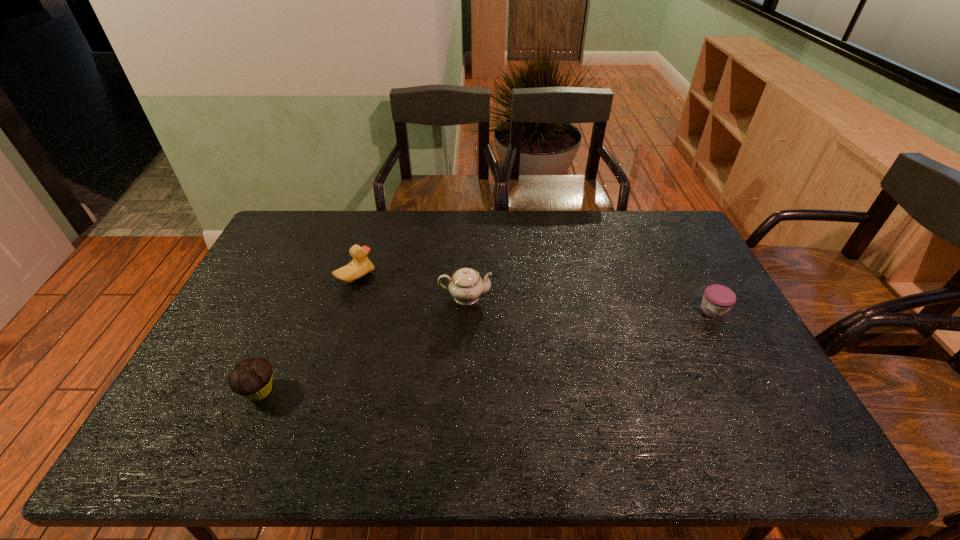
Locate an element on the screen. Image resolution: width=960 pixels, height=540 pixels. the third object from right to left is located at coordinates (360, 266).

Identify the location of the second object from right to left. (465, 285).

You are a GUI agent. You are given a task and a screenshot of the screen. Output one action in this format:
    pyautogui.click(x=<x>, y=<y>)
    Task: Click on the nearest object
    Image resolution: width=960 pixels, height=540 pixels.
    Given the screenshot: What is the action you would take?
    pyautogui.click(x=252, y=377)

What are the coordinates of `muffin` in the screenshot? It's located at (252, 377).

Find the location of a particular element. jam is located at coordinates (718, 299).

Locate an element on the screen. The image size is (960, 540). the rightmost object is located at coordinates (718, 299).

Where is `vacant position located at the beak of the duck`? vacant position located at the beak of the duck is located at coordinates (440, 278).

This screenshot has width=960, height=540. In order to click on vacant space located at the spout of the second object from right to left in this screenshot , I will do `click(599, 296)`.

At what (x,y) coordinates should I click in order to perform the action: click on vacant space located on the right of the muffin. Please return your answer as a coordinate pair (x, y). The width and height of the screenshot is (960, 540). Looking at the image, I should click on (398, 391).

The image size is (960, 540). Find the location of `free space located on the front label of the shortest object`. free space located on the front label of the shortest object is located at coordinates (732, 346).